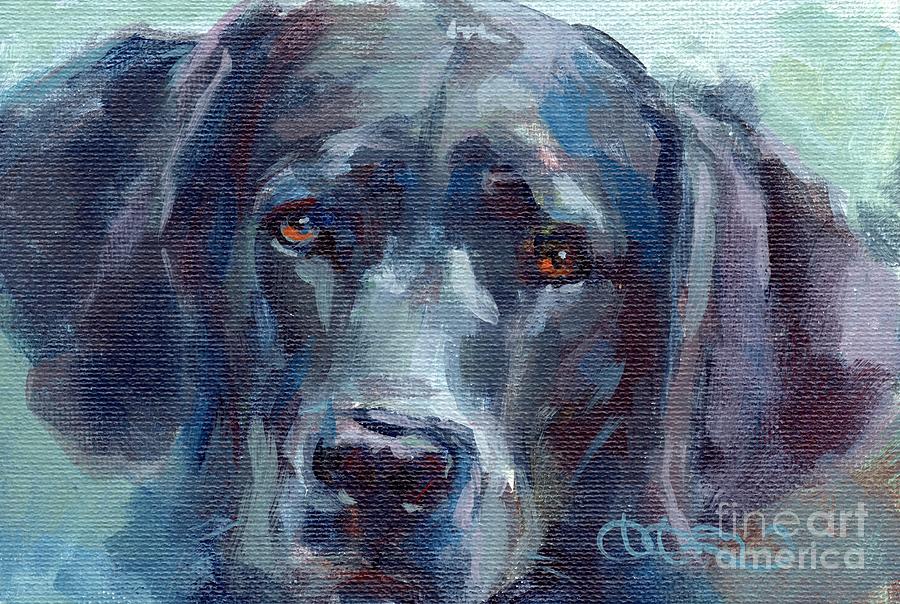
This screenshot has height=604, width=900. I want to click on blue paint, so pos(208,203).